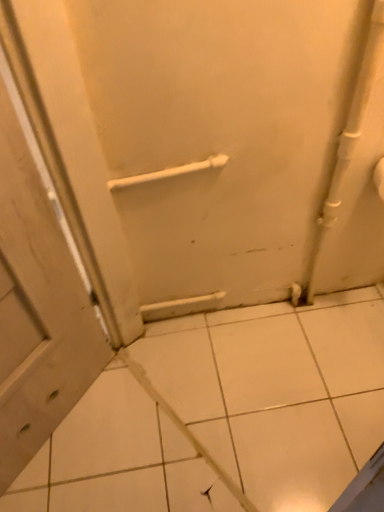
What are the coordinates of `white matte door at left` in the screenshot? It's located at (37, 279).

The image size is (384, 512). Describe the element at coordinates (37, 279) in the screenshot. I see `white matte door at left` at that location.

The image size is (384, 512). I want to click on white matte door at left, so click(37, 279).